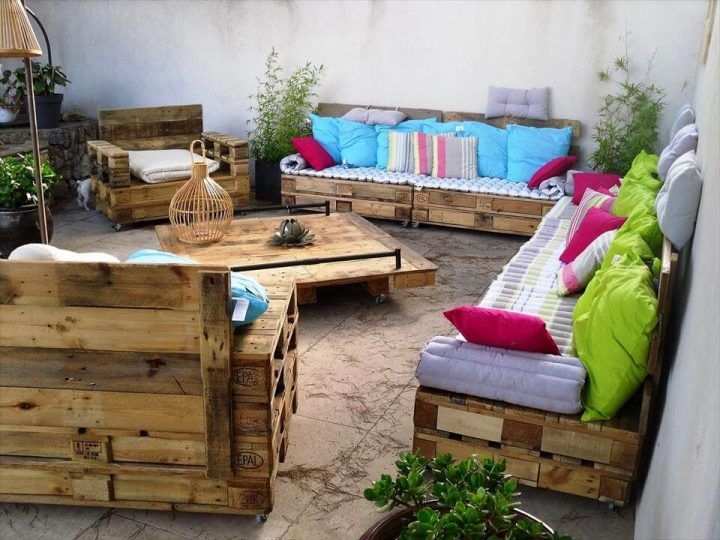
Locate an element on the screen. The height and width of the screenshot is (540, 720). houseplants is located at coordinates (44, 81), (11, 180), (276, 127), (621, 133), (454, 508).